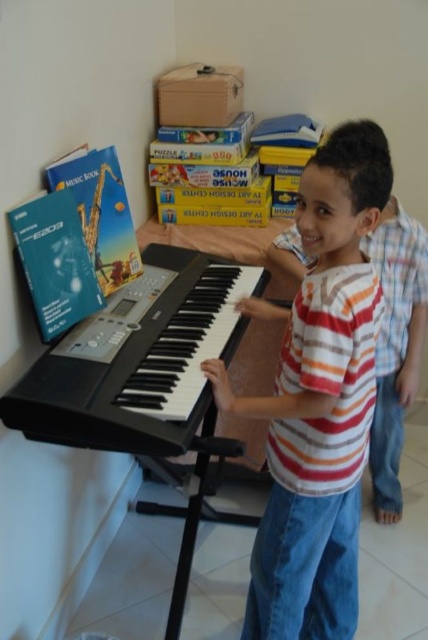
Question: Which object is closer to the camera taking this photo?

Choices:
 (A) black matte keyboard at center
 (B) striped cotton shirt at center

Answer: (B)

Question: Does striped cotton shirt at center have a larger size compared to black matte keyboard at center?

Choices:
 (A) yes
 (B) no

Answer: (A)

Question: Which of the following is the closest to the observer?

Choices:
 (A) (x=344, y=129)
 (B) (x=148, y=452)

Answer: (A)

Question: Among these points, which one is farthest from the camera?

Choices:
 (A) (104, 435)
 (B) (356, 460)

Answer: (B)

Question: Does striped cotton shirt at center appear under black matte keyboard at center?

Choices:
 (A) no
 (B) yes

Answer: (B)

Question: Considering the relative positions of striped cotton shirt at center and black matte keyboard at center in the image provided, where is striped cotton shirt at center located with respect to black matte keyboard at center?

Choices:
 (A) below
 (B) above

Answer: (A)